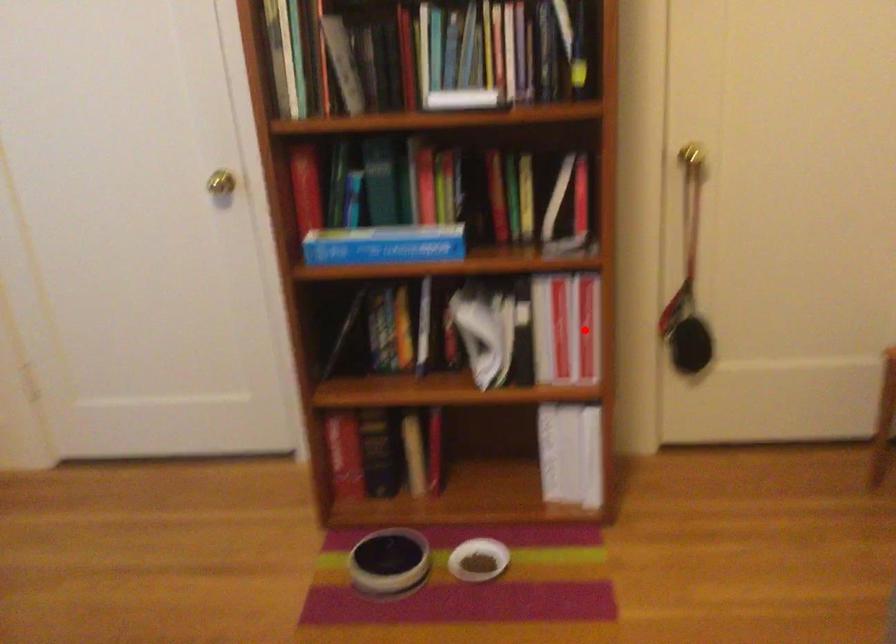
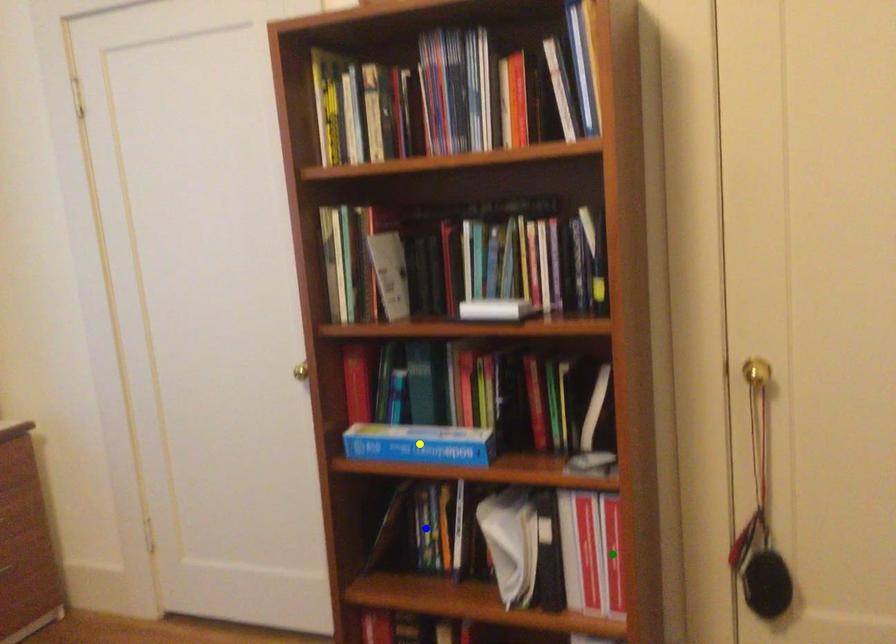
Question: I am providing you with two images of the same scene from different viewpoints. A red point is marked on the first image. You are given multiple points on the second image. Which point in image 2 represents the same 3d spot as the red point in image 1?

Choices:
 (A) green point
 (B) blue point
 (C) yellow point

Answer: (A)